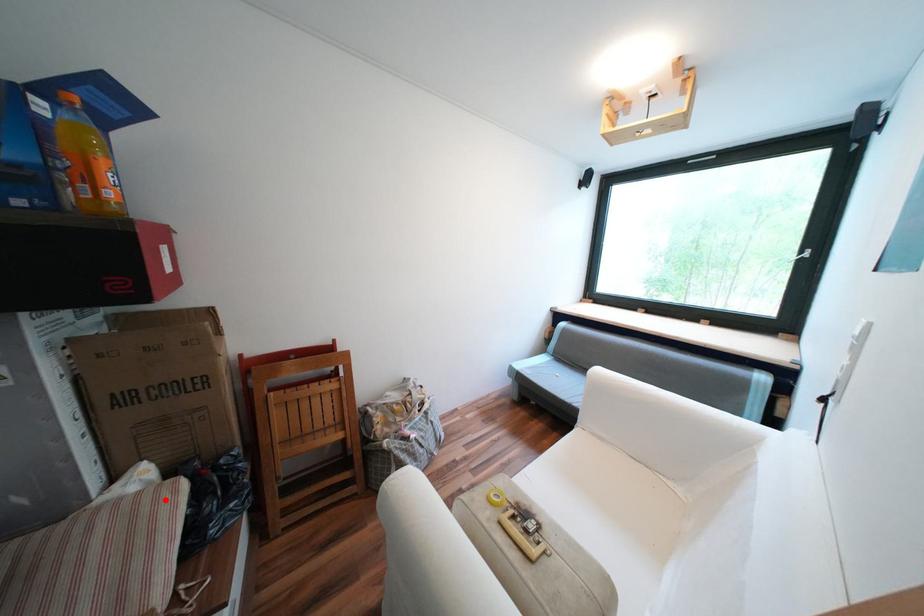
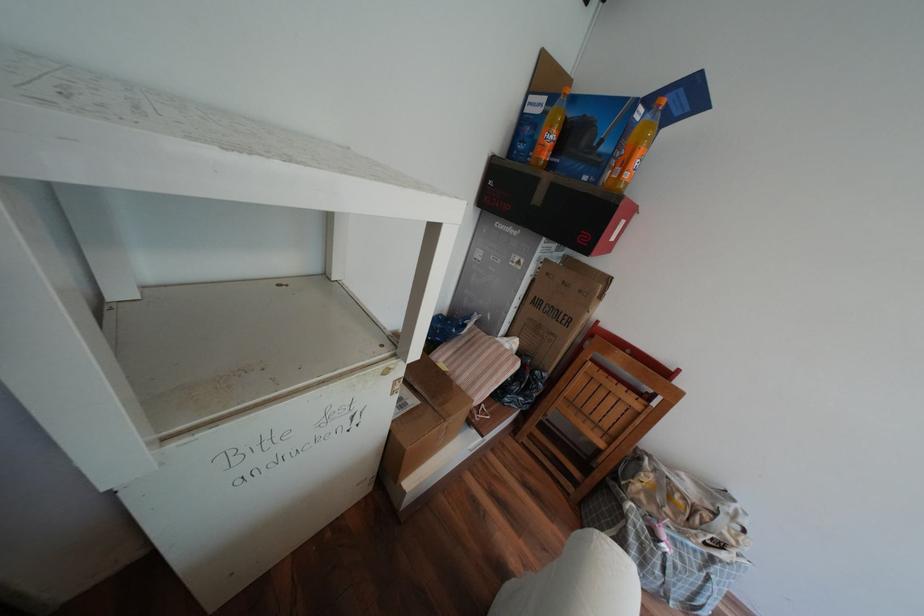
The point at the highlighted location is marked in the first image. Where is the corresponding point in the second image?

(517, 360)